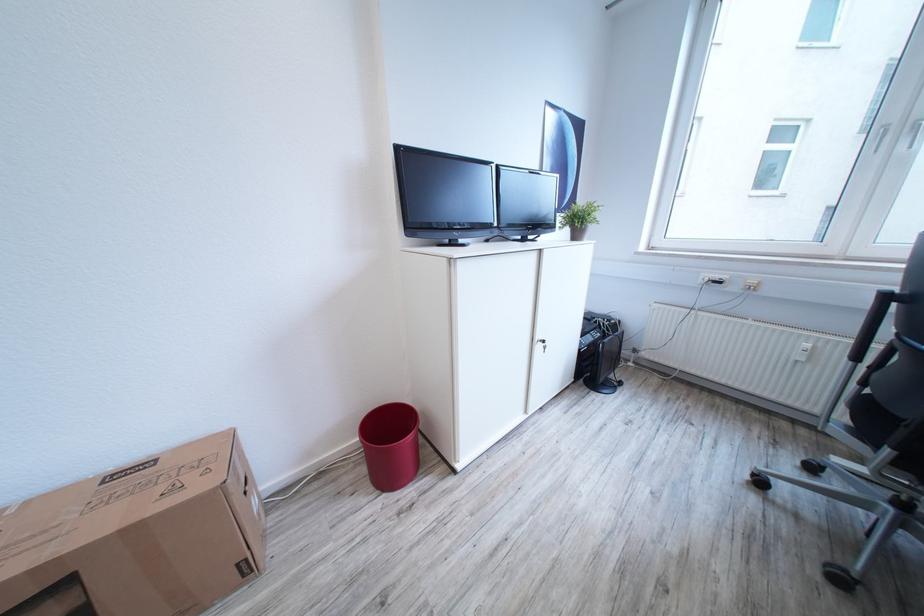
Where would you lift the red trash can? Please return your answer as a coordinate pair (x, y).

(391, 445)